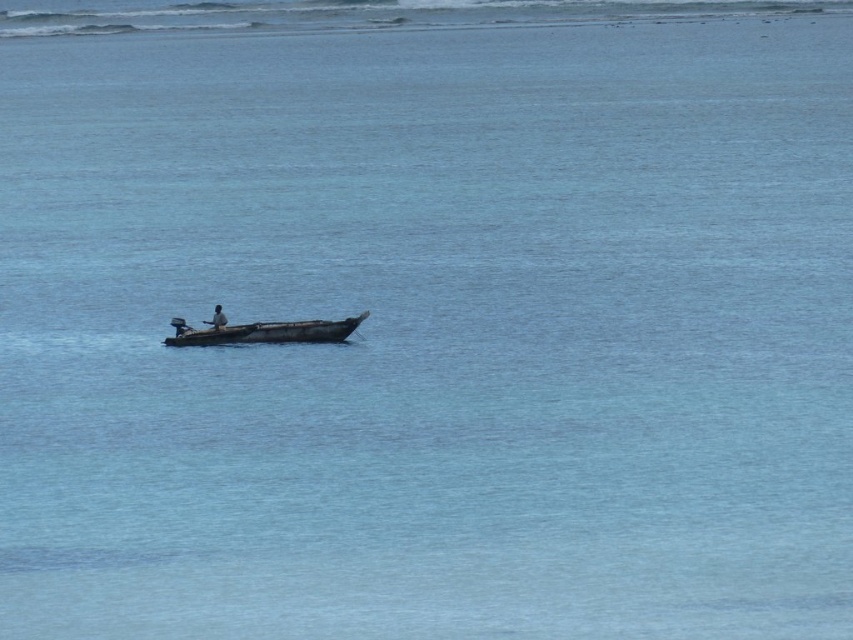
Question: Is wooden boat at center smaller than dark skin person at center?

Choices:
 (A) yes
 (B) no

Answer: (B)

Question: Among these points, which one is farthest from the camera?

Choices:
 (A) (218, 307)
 (B) (262, 323)

Answer: (A)

Question: Can you confirm if wooden boat at center is wider than dark skin person at center?

Choices:
 (A) no
 (B) yes

Answer: (B)

Question: Can you confirm if wooden boat at center is bigger than dark skin person at center?

Choices:
 (A) yes
 (B) no

Answer: (A)

Question: Which point is farther to the camera?

Choices:
 (A) (219, 314)
 (B) (310, 333)

Answer: (A)